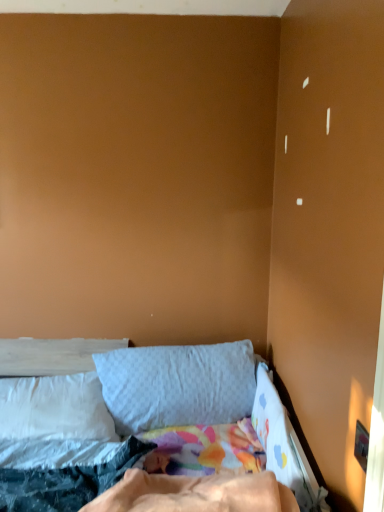
Question: Can you confirm if gray fabric pillow at center, arranged as the second pillow when viewed from the left, is wider than soft cotton bed at lower left?

Choices:
 (A) no
 (B) yes

Answer: (A)

Question: Is gray fabric pillow at center, acting as the first pillow starting from the right, oriented towards soft cotton bed at lower left?

Choices:
 (A) yes
 (B) no

Answer: (A)

Question: Is gray fabric pillow at center, arranged as the second pillow when viewed from the left, further to the viewer compared to soft cotton bed at lower left?

Choices:
 (A) yes
 (B) no

Answer: (A)

Question: Is gray fabric pillow at center, acting as the first pillow starting from the right, shorter than soft cotton bed at lower left?

Choices:
 (A) yes
 (B) no

Answer: (B)

Question: From the image's perspective, is gray fabric pillow at center, arranged as the second pillow when viewed from the left, over soft cotton bed at lower left?

Choices:
 (A) no
 (B) yes

Answer: (B)

Question: Considering the relative positions of gray fabric pillow at center, arranged as the second pillow when viewed from the left, and soft cotton bed at lower left in the image provided, is gray fabric pillow at center, arranged as the second pillow when viewed from the left, in front of soft cotton bed at lower left?

Choices:
 (A) yes
 (B) no

Answer: (B)

Question: Can you confirm if soft cotton bed at lower left is smaller than white soft pillow at left, the 2th pillow when ordered from right to left?

Choices:
 (A) yes
 (B) no

Answer: (B)

Question: Would you say soft cotton bed at lower left contains white soft pillow at left, acting as the 1th pillow starting from the left?

Choices:
 (A) no
 (B) yes

Answer: (A)

Question: Considering the relative positions of soft cotton bed at lower left and white soft pillow at left, the 2th pillow when ordered from right to left, in the image provided, is soft cotton bed at lower left in front of white soft pillow at left, the 2th pillow when ordered from right to left,?

Choices:
 (A) no
 (B) yes

Answer: (B)

Question: From the image's perspective, does soft cotton bed at lower left appear higher than white soft pillow at left, the 2th pillow when ordered from right to left?

Choices:
 (A) yes
 (B) no

Answer: (B)

Question: Is soft cotton bed at lower left shorter than white soft pillow at left, acting as the 1th pillow starting from the left?

Choices:
 (A) no
 (B) yes

Answer: (A)

Question: From a real-world perspective, is soft cotton bed at lower left located beneath white soft pillow at left, acting as the 1th pillow starting from the left?

Choices:
 (A) yes
 (B) no

Answer: (B)

Question: Is soft cotton bed at lower left completely or partially outside of gray fabric pillow at center, arranged as the second pillow when viewed from the left?

Choices:
 (A) yes
 (B) no

Answer: (A)